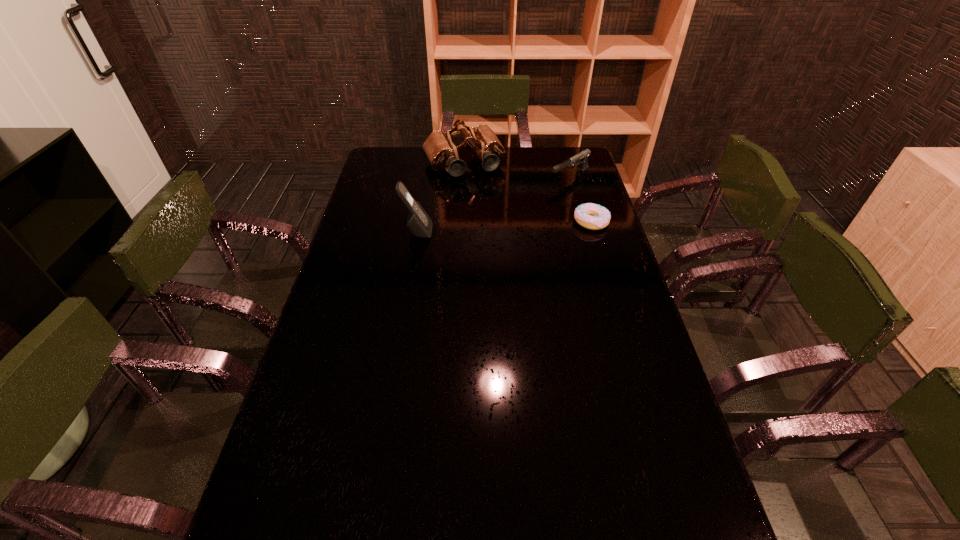
At what (x,y) coordinates should I click in order to perform the action: click on vacant area that lies between the second tallest object and the shortest object. Please return your answer as a coordinate pair (x, y). Looking at the image, I should click on (528, 193).

Select which object is the second closest to the second shortest object. Please provide its 2D coordinates. Your answer should be formatted as a tuple, i.e. [(x, y)], where the tuple contains the x and y coordinates of a point satisfying the conditions above.

[(441, 152)]

Locate an element on the screen. The image size is (960, 540). object that ranks as the second closest to the third shortest object is located at coordinates (418, 222).

Locate an element on the screen. This screenshot has width=960, height=540. vacant space that satisfies the following two spatial constraints: 1. on the front side of the shortest object; 2. on the right side of the gun is located at coordinates [582, 222].

The height and width of the screenshot is (540, 960). What are the coordinates of `vacant space that satisfies the following two spatial constraints: 1. on the front side of the second shortest object; 2. on the left side of the second tallest object` in the screenshot? It's located at (464, 177).